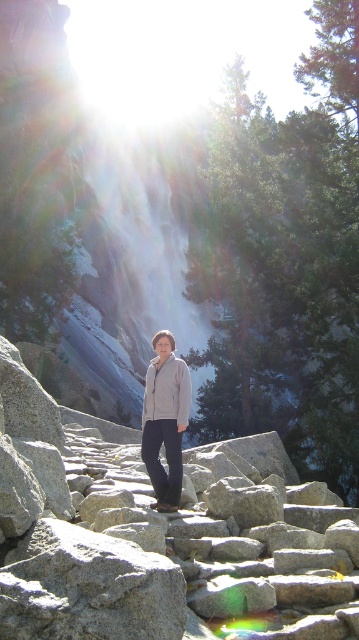
Does point (90, 490) lie behind point (159, 362)?

No, it is in front of (159, 362).

Between point (211, 577) and point (175, 406), which one is positioned in front?

Point (211, 577)

Locate an element on the screen. Image resolution: width=359 pixels, height=640 pixels. smooth granite rocks at center is located at coordinates (160, 534).

The width and height of the screenshot is (359, 640). What do you see at coordinates (165, 420) in the screenshot? I see `light gray fleece jacket at center` at bounding box center [165, 420].

Does light gray fleece jacket at center have a greater height compared to light gray fleece sweatshirt at center?

Yes, light gray fleece jacket at center is taller than light gray fleece sweatshirt at center.

The image size is (359, 640). Describe the element at coordinates (165, 420) in the screenshot. I see `light gray fleece jacket at center` at that location.

Find the location of a particular element. Image resolution: width=359 pixels, height=640 pixels. light gray fleece jacket at center is located at coordinates (165, 420).

Between smooth granite rocks at center and light gray fleece sweatshirt at center, which one is positioned higher?

light gray fleece sweatshirt at center is above.

Can you confirm if smooth granite rocks at center is positioned below light gray fleece sweatshirt at center?

Yes, smooth granite rocks at center is below light gray fleece sweatshirt at center.

Is point (146, 572) positioned before point (146, 385)?

Yes, it is in front of point (146, 385).

I want to click on smooth granite rocks at center, so click(160, 534).